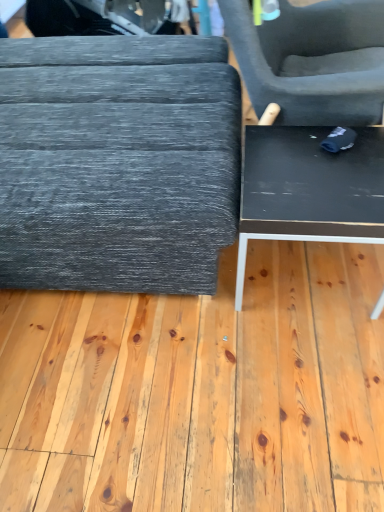
Question: From the image's perspective, does black matte plywood at center appear lower than black glossy table at lower right, the 2th table positioned from the left?

Choices:
 (A) no
 (B) yes

Answer: (A)

Question: Could you tell me if black matte plywood at center is facing black glossy table at lower right, arranged as the first table when viewed from the right?

Choices:
 (A) no
 (B) yes

Answer: (A)

Question: Can you confirm if black matte plywood at center is thinner than black glossy table at lower right, arranged as the first table when viewed from the right?

Choices:
 (A) yes
 (B) no

Answer: (B)

Question: Is black matte plywood at center behind black glossy table at lower right, arranged as the first table when viewed from the right?

Choices:
 (A) yes
 (B) no

Answer: (B)

Question: Considering the relative sizes of black matte plywood at center and black glossy table at lower right, arranged as the first table when viewed from the right, in the image provided, is black matte plywood at center bigger than black glossy table at lower right, arranged as the first table when viewed from the right,?

Choices:
 (A) yes
 (B) no

Answer: (A)

Question: Looking at the image, does matte gray ottoman at left, acting as the 2th table starting from the right, seem bigger or smaller compared to black glossy table at lower right, arranged as the first table when viewed from the right?

Choices:
 (A) big
 (B) small

Answer: (A)

Question: In the image, is matte gray ottoman at left, acting as the 2th table starting from the right, positioned in front of or behind black glossy table at lower right, the 2th table positioned from the left?

Choices:
 (A) behind
 (B) front

Answer: (B)

Question: Is matte gray ottoman at left, the 1th table viewed from the left, spatially inside black glossy table at lower right, the 2th table positioned from the left, or outside of it?

Choices:
 (A) inside
 (B) outside

Answer: (B)

Question: Considering the positions of point (23, 46) and point (254, 190), is point (23, 46) closer or farther from the camera than point (254, 190)?

Choices:
 (A) farther
 (B) closer

Answer: (A)

Question: Is black glossy table at lower right, arranged as the first table when viewed from the right, in front of or behind matte gray ottoman at left, the 1th table viewed from the left, in the image?

Choices:
 (A) front
 (B) behind

Answer: (B)

Question: Is black glossy table at lower right, the 2th table positioned from the left, inside the boundaries of matte gray ottoman at left, the 1th table viewed from the left, or outside?

Choices:
 (A) outside
 (B) inside

Answer: (A)

Question: Is black glossy table at lower right, arranged as the first table when viewed from the right, wider or thinner than matte gray ottoman at left, the 1th table viewed from the left?

Choices:
 (A) wide
 (B) thin

Answer: (B)

Question: Is black glossy table at lower right, the 2th table positioned from the left, bigger or smaller than matte gray ottoman at left, acting as the 2th table starting from the right?

Choices:
 (A) small
 (B) big

Answer: (A)

Question: From the image's perspective, is black matte plywood at center positioned above or below matte gray ottoman at left, acting as the 2th table starting from the right?

Choices:
 (A) above
 (B) below

Answer: (A)

Question: Is black matte plywood at center to the left or to the right of matte gray ottoman at left, acting as the 2th table starting from the right, in the image?

Choices:
 (A) left
 (B) right

Answer: (B)